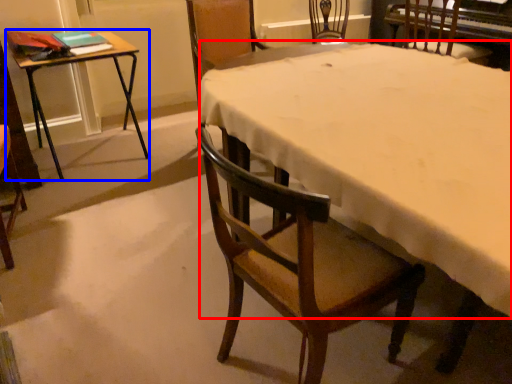
Question: Which object is further to the camera taking this photo, tablecloth (highlighted by a red box) or table (highlighted by a blue box)?

Choices:
 (A) tablecloth
 (B) table

Answer: (B)